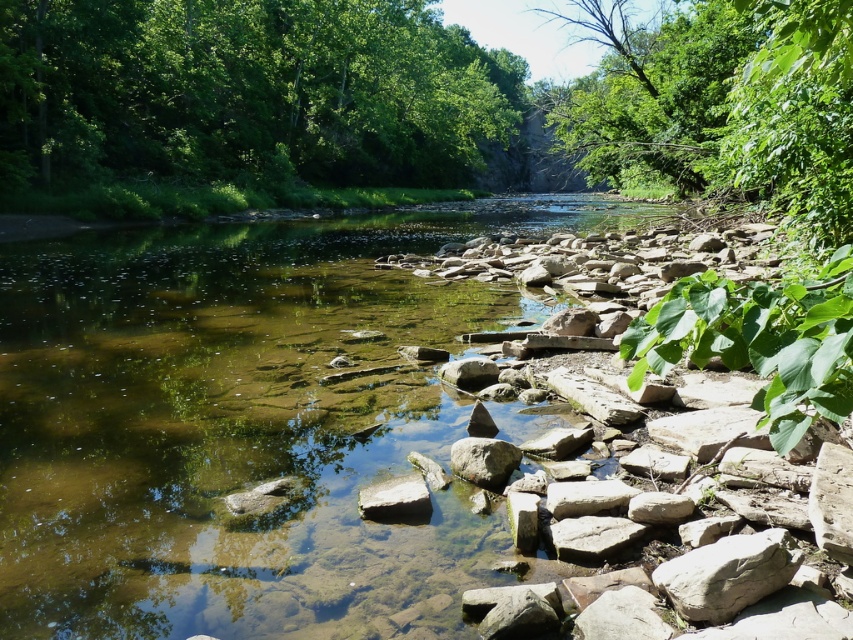
Between green leafy trees at upper left and smooth gray rock at center, which one appears on the right side from the viewer's perspective?

Positioned to the right is smooth gray rock at center.

Is green leafy trees at upper left positioned in front of smooth gray rock at center?

No, green leafy trees at upper left is further to the viewer.

Between point (451, 42) and point (468, 464), which one is positioned behind?

The point (451, 42) is behind.

Find the location of a particular element. The image size is (853, 640). green leafy trees at upper left is located at coordinates (247, 92).

Between gray rough rock at lower right and smooth gray rock at center, which one is positioned lower?

gray rough rock at lower right is below.

Does point (709, 608) come behind point (502, 458)?

No, it is in front of (502, 458).

You are a GUI agent. You are given a task and a screenshot of the screen. Output one action in this format:
    pyautogui.click(x=<x>, y=<y>)
    Task: Click on the gray rough rock at lower right
    The height and width of the screenshot is (640, 853).
    Given the screenshot: What is the action you would take?
    pyautogui.click(x=727, y=573)

Which of these two, green leafy trees at upper left or gray rough rock at lower right, stands taller?

With more height is green leafy trees at upper left.

Is green leafy trees at upper left thinner than gray rough rock at lower right?

No.

Who is more distant from viewer, (x=280, y=67) or (x=704, y=564)?

The point (x=280, y=67) is behind.

In order to click on green leafy trees at upper left in this screenshot , I will do `click(247, 92)`.